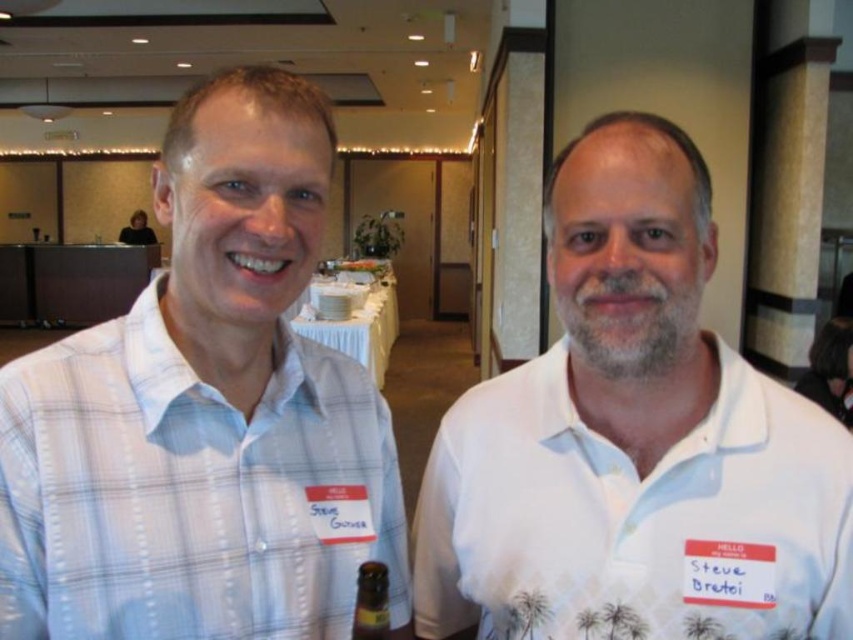
Question: In this image, where is light blue plaid shirt at left located relative to white cotton polo shirt at right?

Choices:
 (A) left
 (B) right

Answer: (A)

Question: Among these objects, which one is farthest from the camera?

Choices:
 (A) brown glass bottle at center
 (B) white cotton polo shirt at right

Answer: (B)

Question: Is white cotton polo shirt at right further to camera compared to brown glass bottle at center?

Choices:
 (A) yes
 (B) no

Answer: (A)

Question: Which object is positioned farthest from the white cotton polo shirt at right?

Choices:
 (A) brown glass bottle at center
 (B) light blue plaid shirt at left

Answer: (A)

Question: Does white cotton polo shirt at right appear on the left side of brown glass bottle at center?

Choices:
 (A) yes
 (B) no

Answer: (B)

Question: Which of the following is the closest to the observer?

Choices:
 (A) (x=679, y=323)
 (B) (x=372, y=611)
 (C) (x=392, y=480)

Answer: (B)